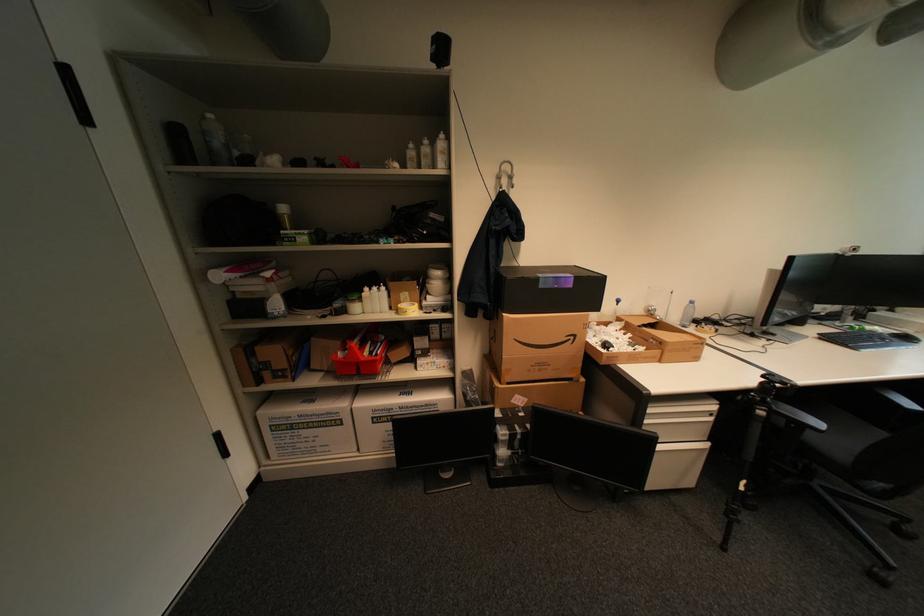
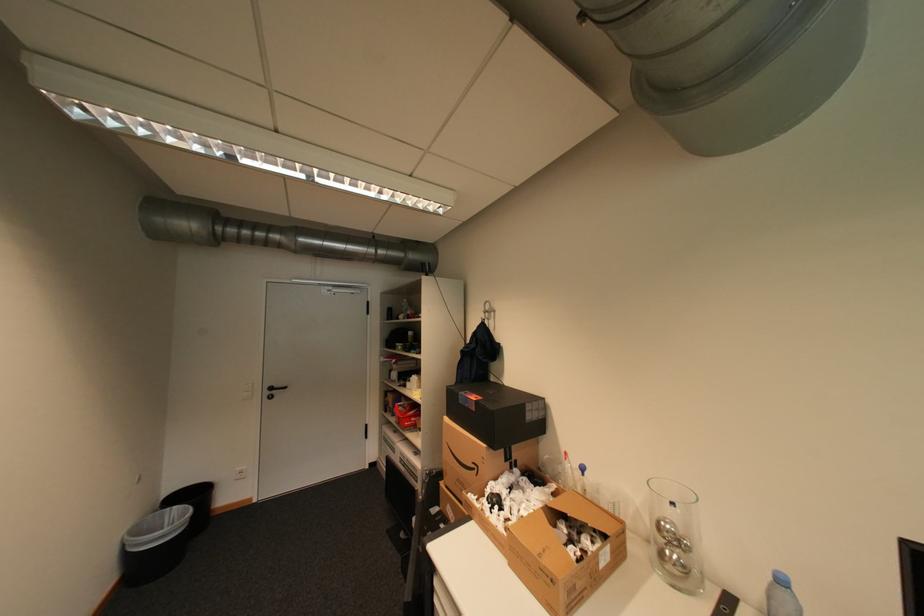
In the second image, find the point that corresponds to pixel 580 338 in the first image.

(484, 468)